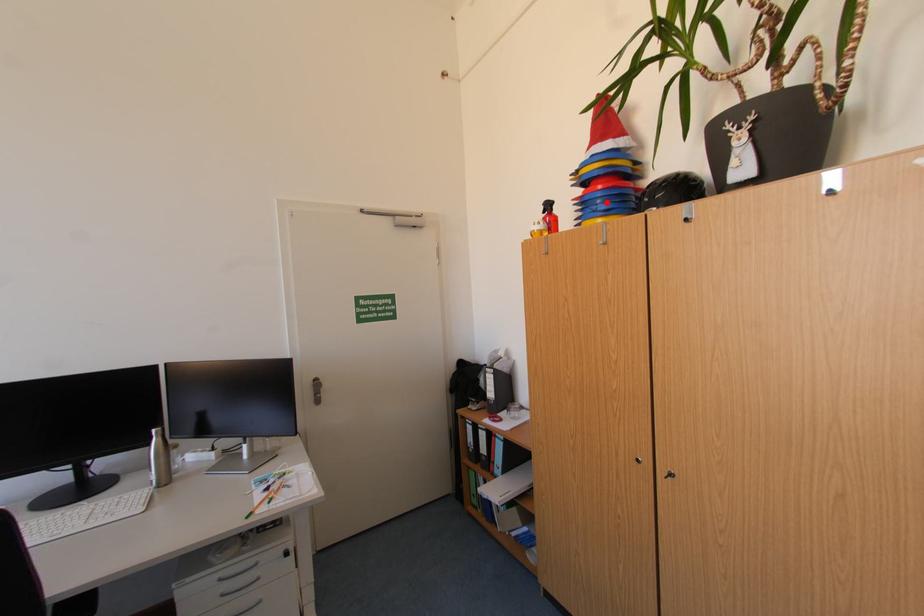
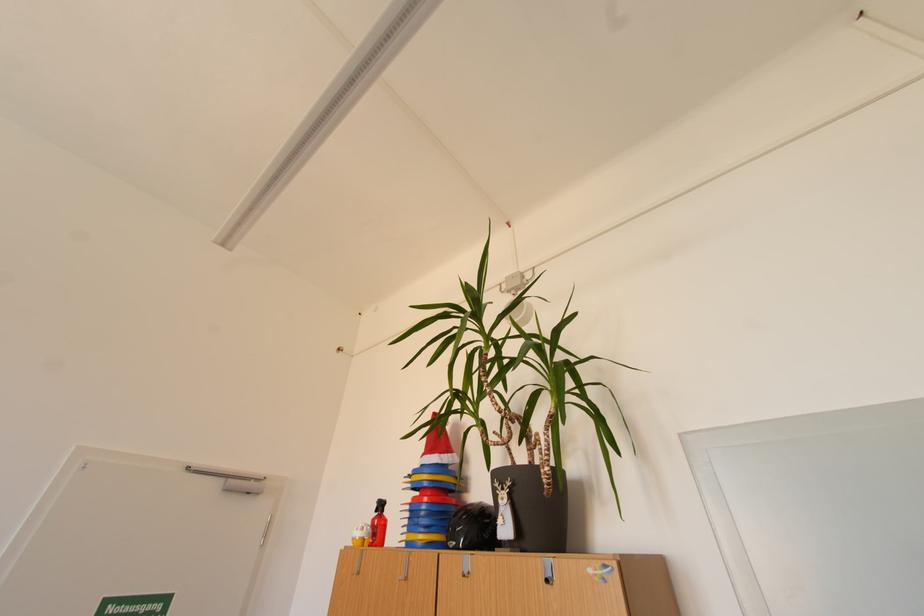
In the second image, find the point that corresponds to the highlighted location in the first image.

(431, 514)